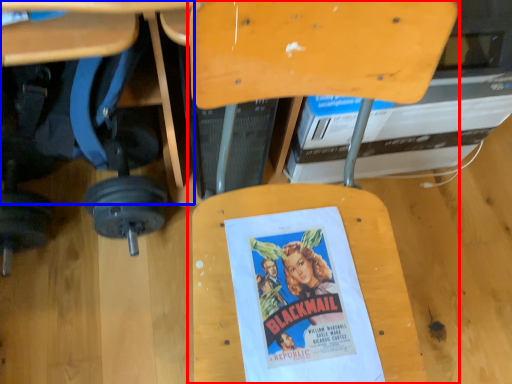
Question: Which object is further to the camera taking this photo, chair (highlighted by a red box) or table (highlighted by a blue box)?

Choices:
 (A) chair
 (B) table

Answer: (B)